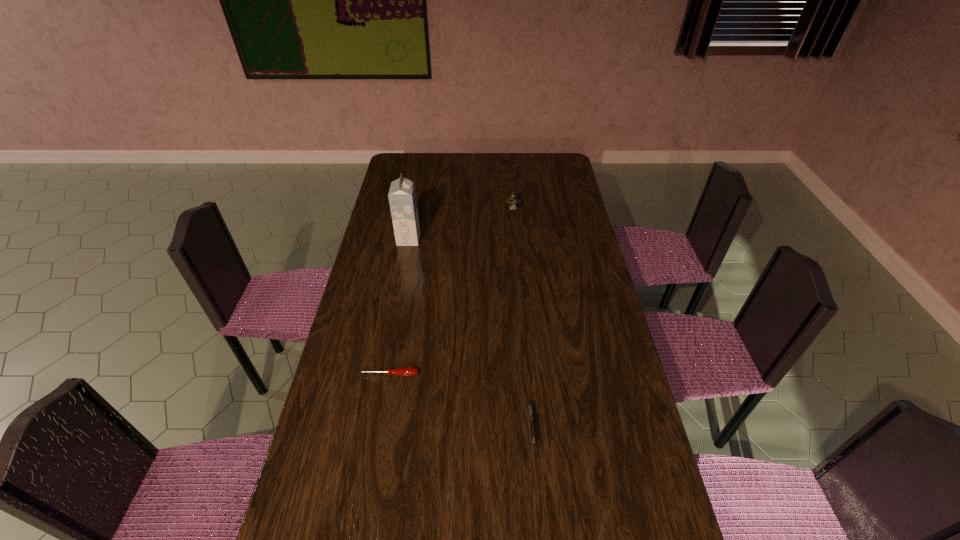
The image size is (960, 540). I want to click on free location that satisfies the following two spatial constraints: 1. on the front label of the tallest object; 2. on the left side of the shortest object, so click(384, 374).

The height and width of the screenshot is (540, 960). Identify the location of vacant point that satisfies the following two spatial constraints: 1. on the front label of the second farthest object; 2. on the right side of the second nearest object. (384, 374).

This screenshot has width=960, height=540. I want to click on vacant space that satisfies the following two spatial constraints: 1. on the front label of the screwdriver; 2. on the left side of the third nearest object, so click(x=384, y=374).

The image size is (960, 540). Find the location of `free space that satisfies the following two spatial constraints: 1. on the face of the second tallest object; 2. on the front label of the tallest object`. free space that satisfies the following two spatial constraints: 1. on the face of the second tallest object; 2. on the front label of the tallest object is located at coordinates (516, 239).

At what (x,y) coordinates should I click in order to perform the action: click on free spot that satisfies the following two spatial constraints: 1. on the front label of the second nearest object; 2. on the right side of the carton. Please return your answer as a coordinate pair (x, y). Image resolution: width=960 pixels, height=540 pixels. Looking at the image, I should click on (384, 374).